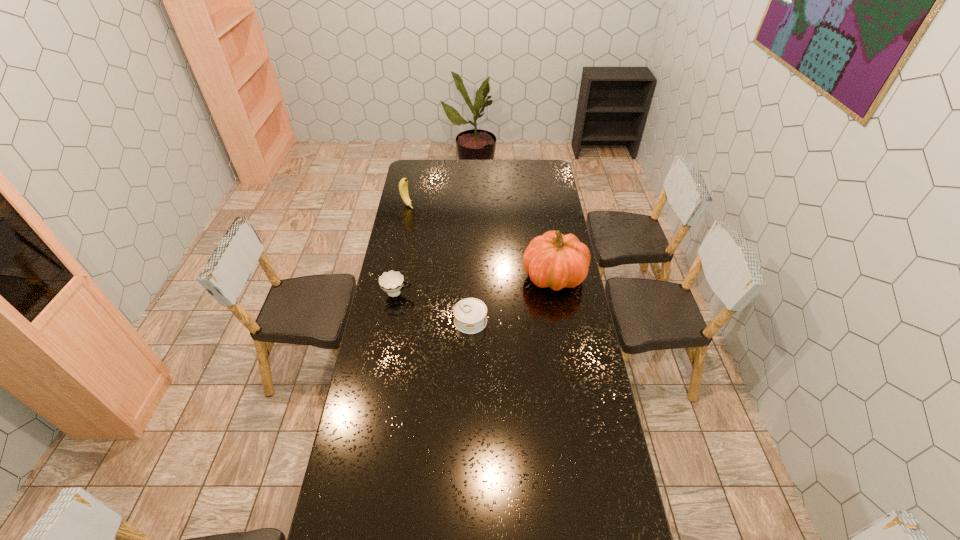
Identify the location of can. This screenshot has width=960, height=540. (470, 314).

The height and width of the screenshot is (540, 960). I want to click on the nearest object, so click(470, 314).

Locate an element on the screen. This screenshot has height=540, width=960. the rightmost object is located at coordinates (554, 260).

The image size is (960, 540). I want to click on the tallest object, so [554, 260].

Where is `the third shortest object`? the third shortest object is located at coordinates (403, 184).

Find the location of a particular element. The image size is (960, 540). banana is located at coordinates (403, 184).

I want to click on cup, so pyautogui.click(x=392, y=282).

This screenshot has height=540, width=960. Find the location of `vacant space located 0.110m on the right of the shortest object`. vacant space located 0.110m on the right of the shortest object is located at coordinates (514, 321).

The width and height of the screenshot is (960, 540). In order to click on vacant space located on the left of the rightmost object in this screenshot , I will do `click(479, 277)`.

Where is `vacant area located from the stem of the second tallest object`? vacant area located from the stem of the second tallest object is located at coordinates (424, 219).